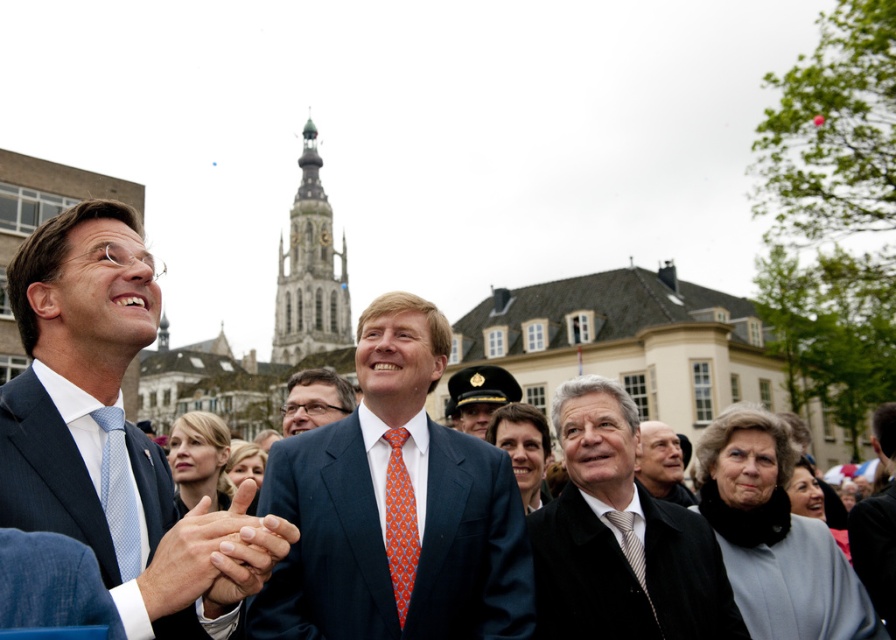
Looking at this image, is dark gray wool coat at center closer to camera compared to matte black hat at center?

Yes, dark gray wool coat at center is in front of matte black hat at center.

Between point (583, 621) and point (483, 364), which one is positioned behind?

Point (483, 364)

Looking at this image, who is more forward, (662,616) or (490,381)?

Point (662,616)

Locate an element on the screen. The width and height of the screenshot is (896, 640). dark gray wool coat at center is located at coordinates (619, 538).

Is dark gray wool coat at center taller than orange printed tie at center?

Correct, dark gray wool coat at center is much taller as orange printed tie at center.

Does point (606, 468) come behind point (389, 572)?

Yes, point (606, 468) is farther from viewer.

Locate an element on the screen. dark gray wool coat at center is located at coordinates (619, 538).

Where is `dark gray wool coat at center`? This screenshot has width=896, height=640. dark gray wool coat at center is located at coordinates (619, 538).

Can you confirm if matte blue suit at left is positioned to the right of matte black hat at center?

In fact, matte blue suit at left is to the left of matte black hat at center.

The image size is (896, 640). What are the coordinates of `matte blue suit at left` in the screenshot? It's located at (113, 435).

Where is `matte blue suit at left`? The image size is (896, 640). matte blue suit at left is located at coordinates (113, 435).